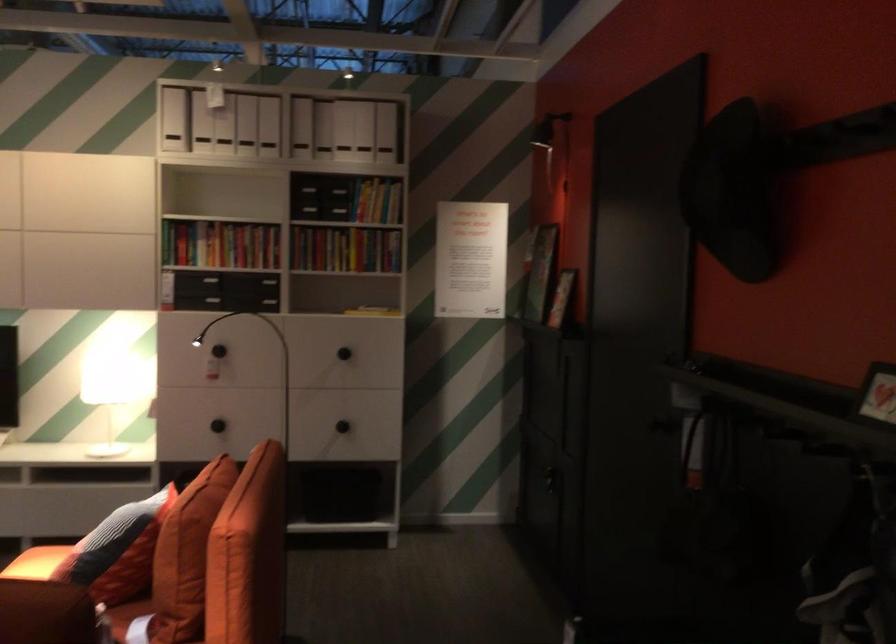
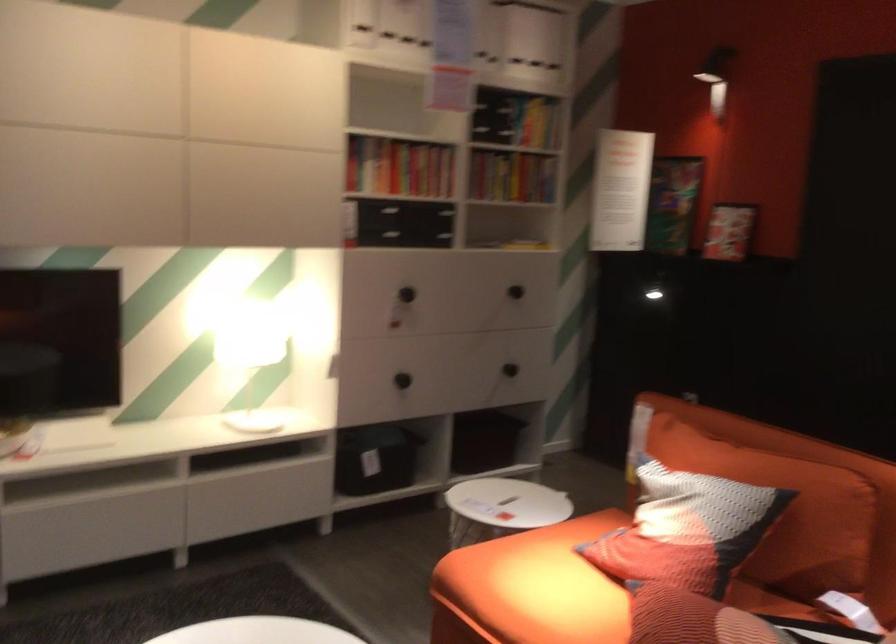
The point at (341, 319) is marked in the first image. Where is the corresponding point in the second image?

(524, 245)